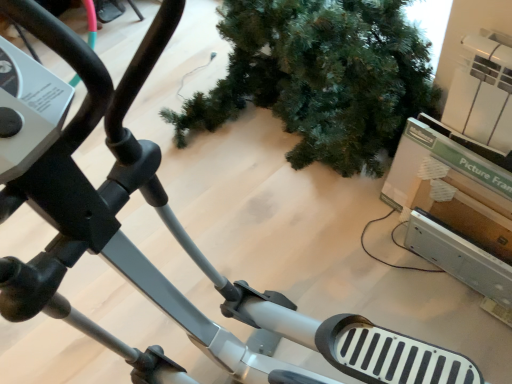
The image size is (512, 384). Find the location of `free space in front of white plastic wii at lower right`. free space in front of white plastic wii at lower right is located at coordinates (471, 326).